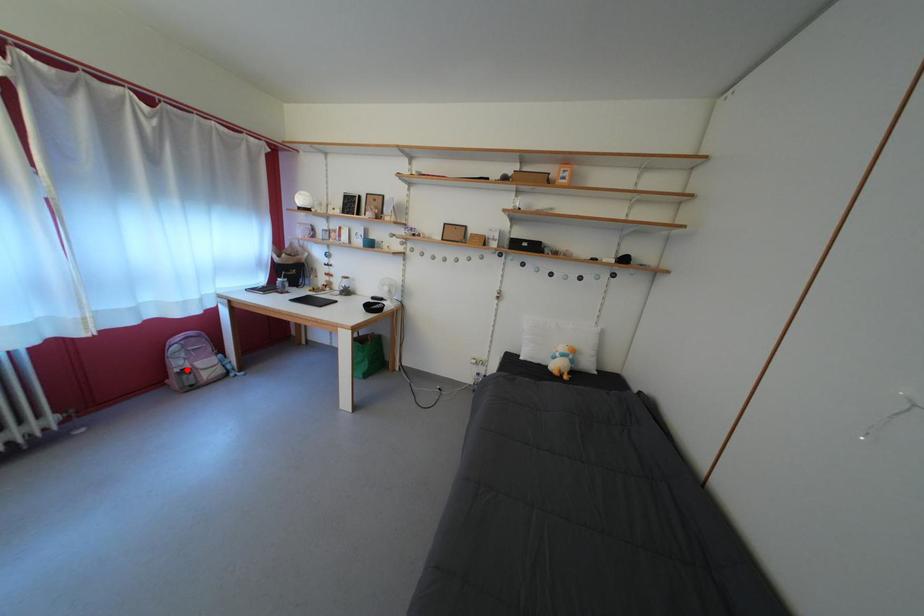
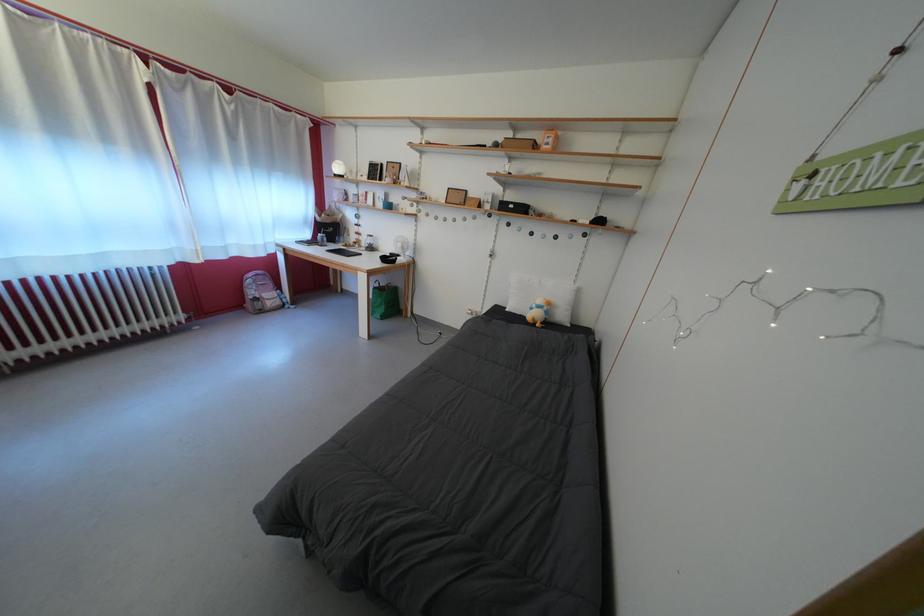
Question: A red point is marked in image1. In image2, is the corresponding 3D point closer to the camera or farther? Reply with the corresponding letter.

Choices:
 (A) The corresponding 3D point is closer.
 (B) The corresponding 3D point is farther.

Answer: (A)